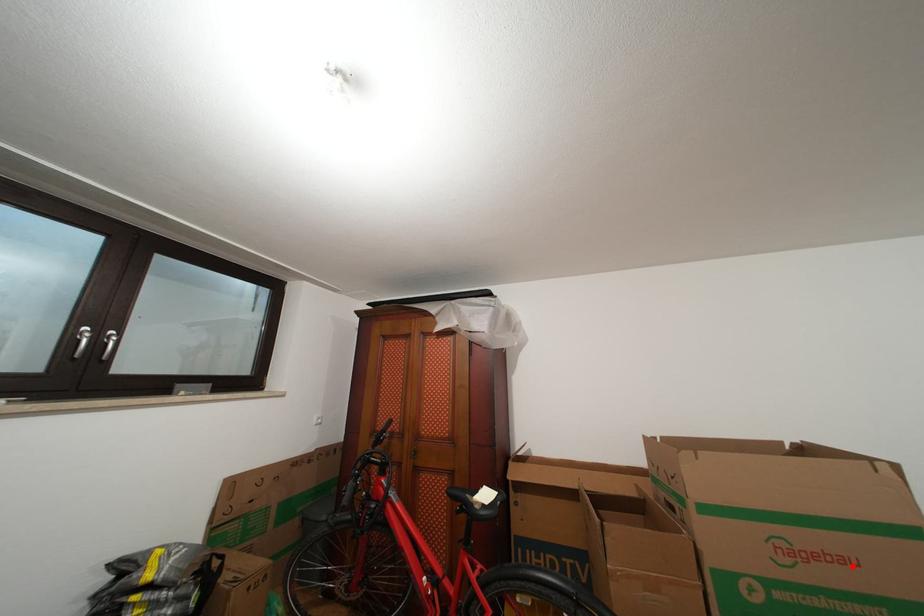
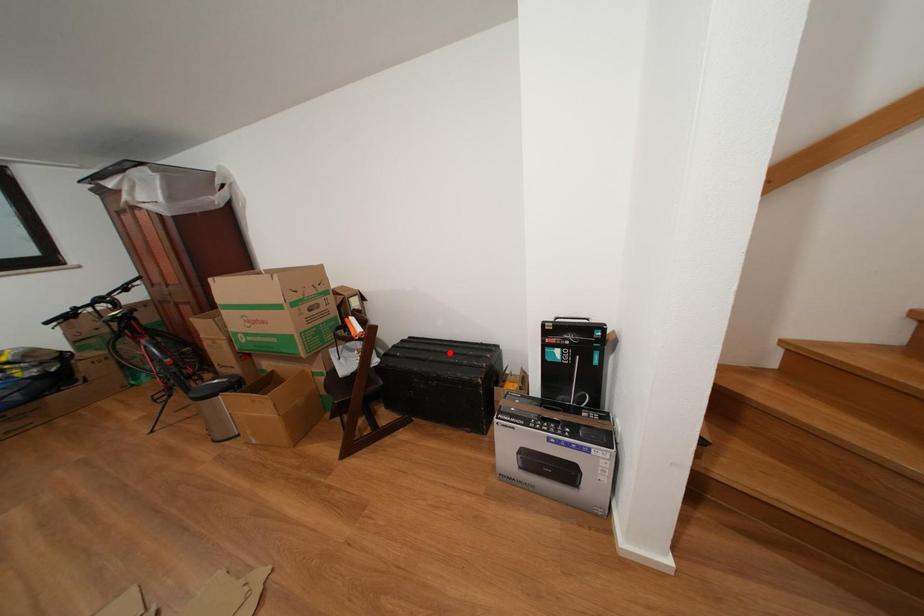
I am providing you with two images of the same scene from different viewpoints. A red point is marked on the first image and another point is marked on the second image. Do the highlighted points in image1 and image2 indicate the same real-world spot?

No